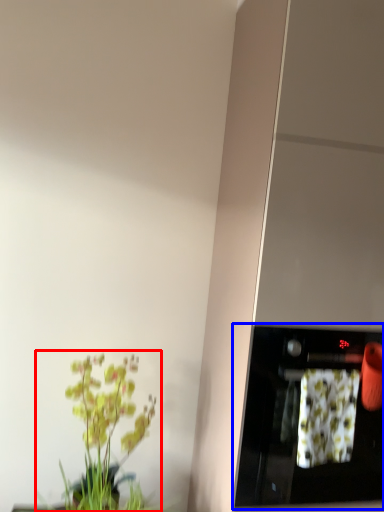
Question: Which object is closer to the camera taking this photo, houseplant (highlighted by a red box) or appliance (highlighted by a blue box)?

Choices:
 (A) houseplant
 (B) appliance

Answer: (B)